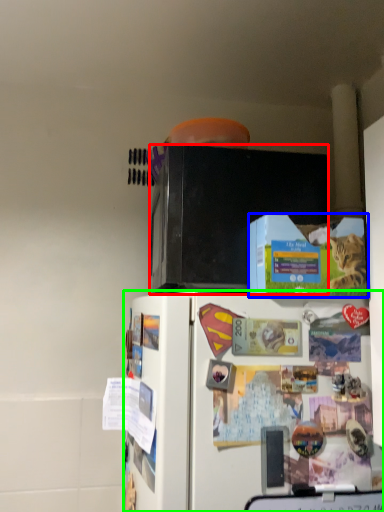
Question: Which object is positioned farthest from microwave oven (highlighted by a red box)? Select from box (highlighted by a blue box) and refrigerator (highlighted by a green box).

Choices:
 (A) box
 (B) refrigerator

Answer: (B)